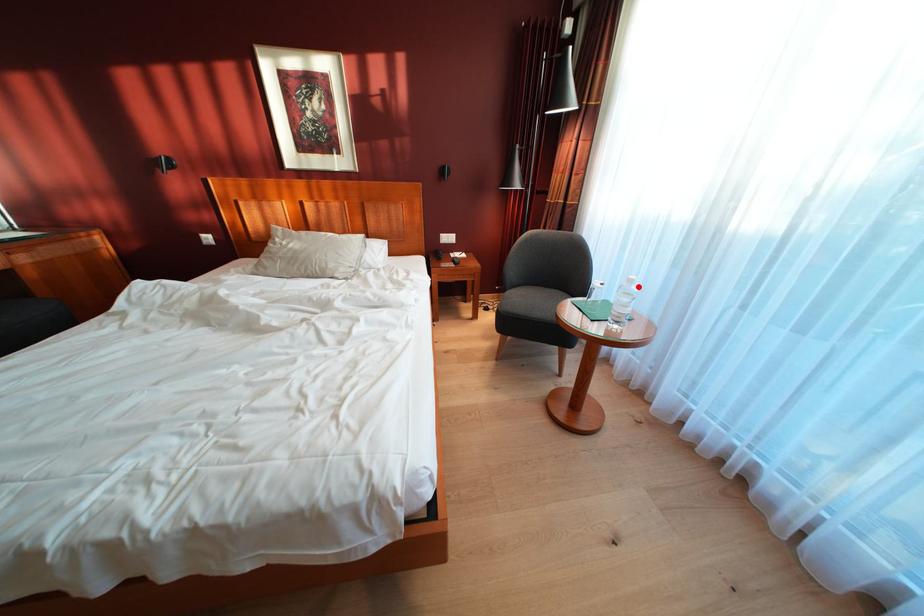
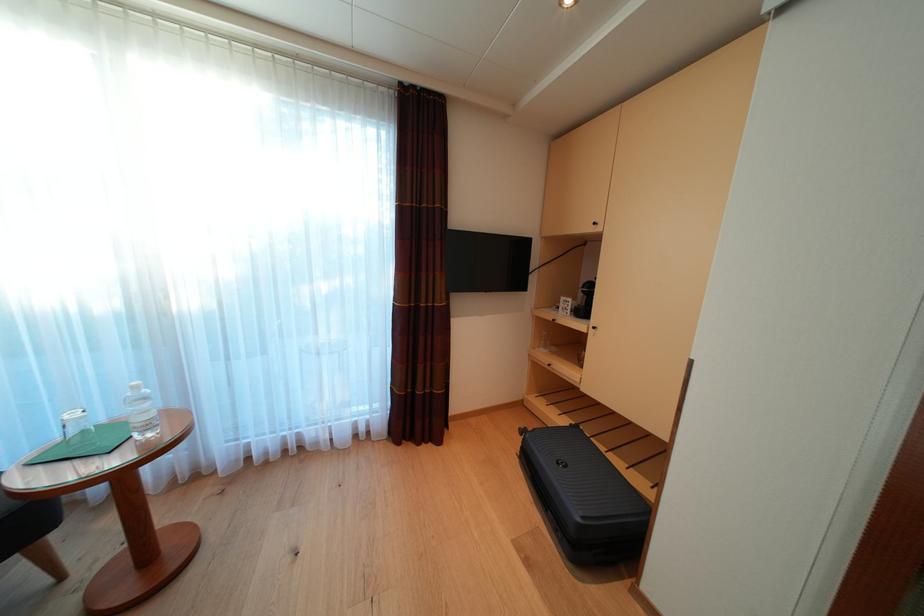
Question: I am providing you with two images of the same scene from different viewpoints. In image1, a red point is highlighted. Considering the same 3D point in image2, which of the following is correct?

Choices:
 (A) It is closer
 (B) It is farther

Answer: (B)